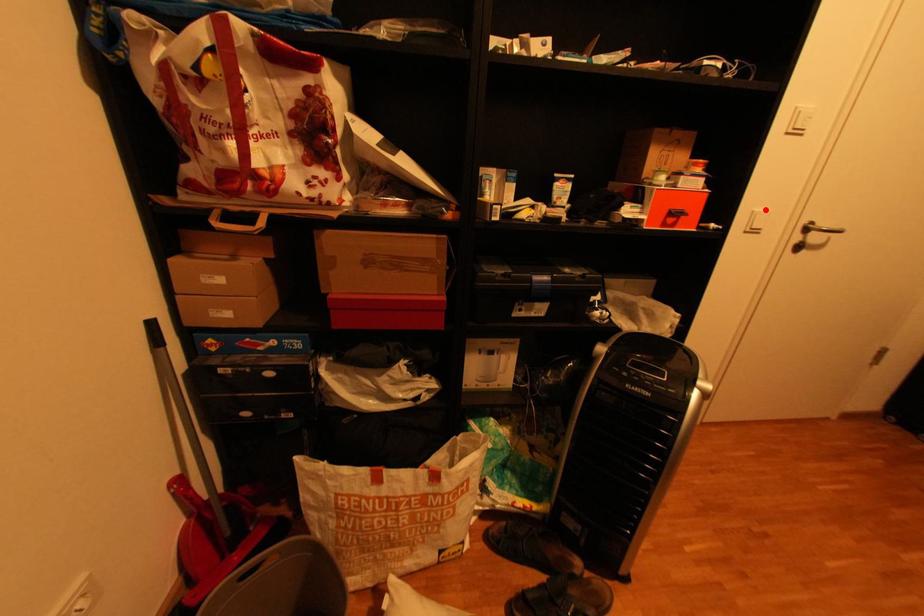
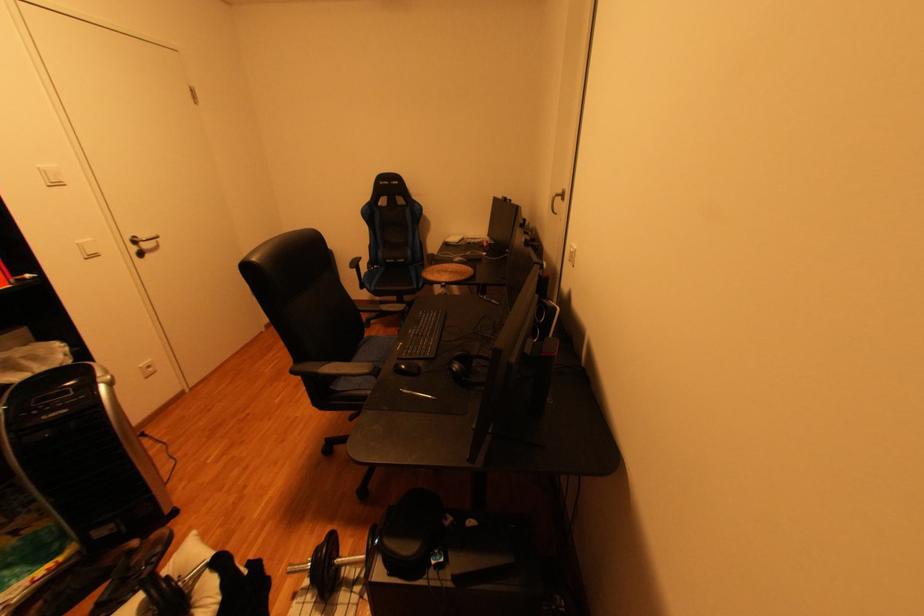
In the second image, find the point that corresponds to the highlighted location in the first image.

(89, 243)